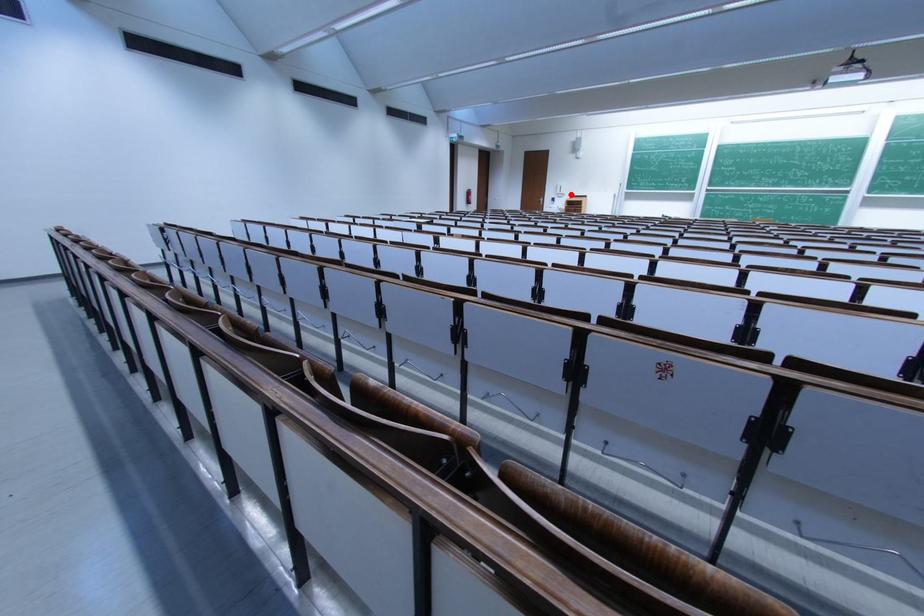
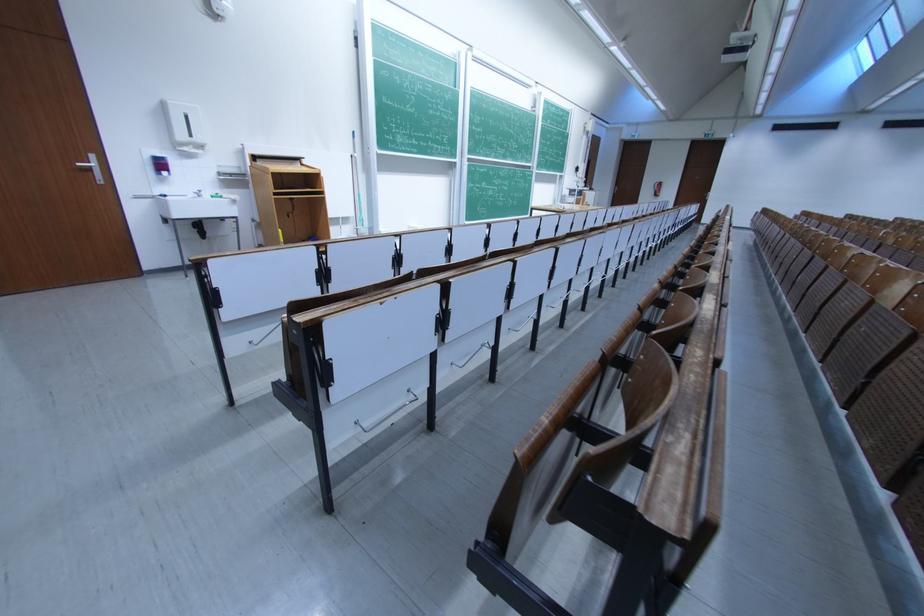
Question: I am providing you with two images of the same scene from different viewpoints. Given a red point in image1, look at the same physical point in image2. Is it:

Choices:
 (A) Closer to the viewpoint
 (B) Farther from the viewpoint

Answer: (B)